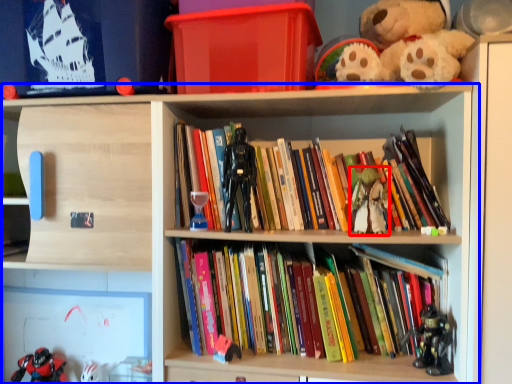
Question: Among these objects, which one is nearest to the camera, toy (highlighted by a red box) or shelf (highlighted by a blue box)?

Choices:
 (A) toy
 (B) shelf

Answer: (B)